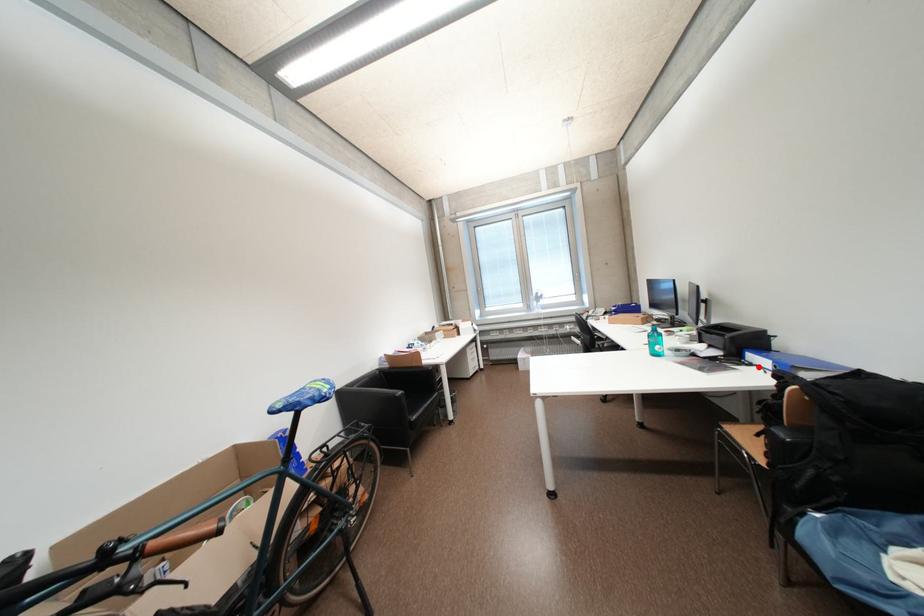
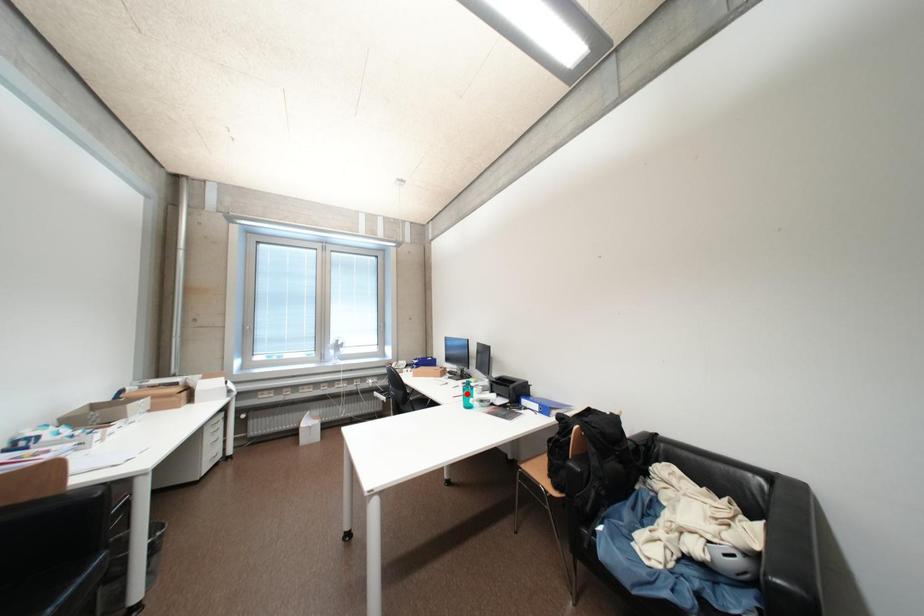
I am providing you with two images of the same scene from different viewpoints. A red point is marked on the first image and another point is marked on the second image. Is the marked point in image1 the same physical position as the marked point in image2?

No